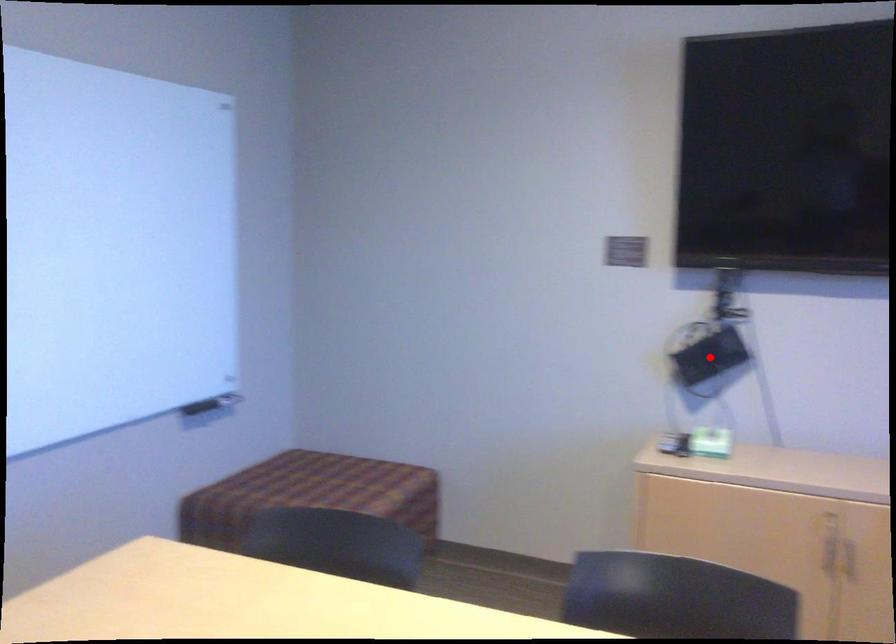
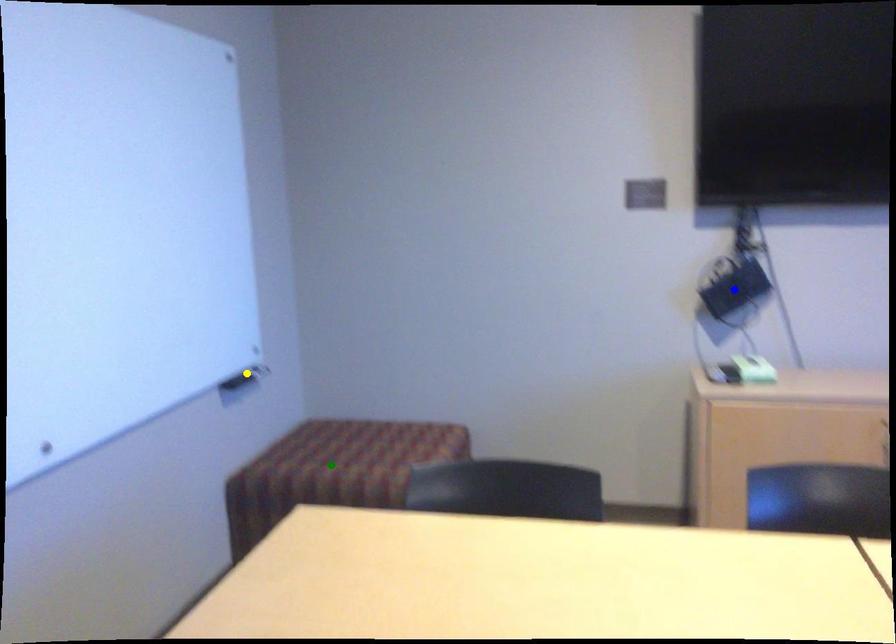
Question: I am providing you with two images of the same scene from different viewpoints. A red point is marked on the first image. You are given multiple points on the second image. Which mark in image 2 goes with the point in image 1?

Choices:
 (A) yellow point
 (B) blue point
 (C) green point

Answer: (B)